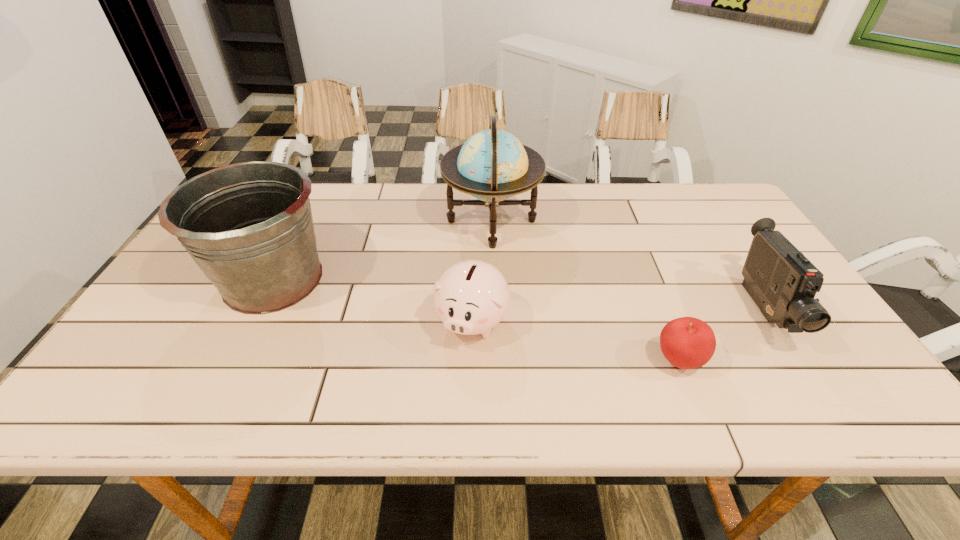
Locate an element on the screen. vacant space at the left edge is located at coordinates (182, 336).

In the image, there is a desktop. Where is `vacant space at the right edge`? The width and height of the screenshot is (960, 540). vacant space at the right edge is located at coordinates (731, 258).

In order to click on vacant space at the near left corner in this screenshot , I will do point(147,416).

In the image, there is a desktop. Where is `vacant area at the near right corner`? vacant area at the near right corner is located at coordinates (798, 383).

I want to click on empty space that is in between the tallest object and the shortest object, so click(x=585, y=291).

The height and width of the screenshot is (540, 960). Find the location of `free space between the camcorder and the apple`. free space between the camcorder and the apple is located at coordinates (720, 335).

This screenshot has height=540, width=960. I want to click on empty space that is in between the tallest object and the shortest object, so click(585, 291).

Find the location of a particular element. This screenshot has width=960, height=540. vacant area that lies between the rightmost object and the piggy bank is located at coordinates [617, 315].

The width and height of the screenshot is (960, 540). In order to click on unoccupied position between the camcorder and the globe in this screenshot , I will do `click(627, 266)`.

Identify which object is the second nearest to the shortest object. Please provide its 2D coordinates. Your answer should be formatted as a tuple, i.e. [(x, y)], where the tuple contains the x and y coordinates of a point satisfying the conditions above.

[(471, 297)]